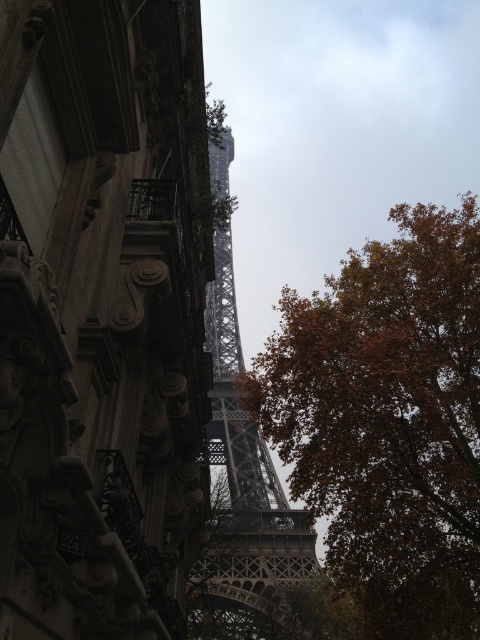
You are a tourist holding a camera and want to take a photo of the metallic gray eiffel tower at center without the brown leafy tree at center blocking the view. Which direction should you move to achieve this?

To avoid the brown leafy tree at center blocking the view of the metallic gray eiffel tower at center, you should move to the left or right side of the path between them, as the tree is directly in front of the tower. Since the distance between them is 25.39 meters, moving sideways could provide an unobstructed view.

You are standing at the base of the Eiffel Tower and notice a brown leafy tree at center. According to the coordinates provided, is the tree closer to the left or right side of the image?

The brown leafy tree at center is located at point 0.658 on the x and y axis, which places it closer to the right side of the image.